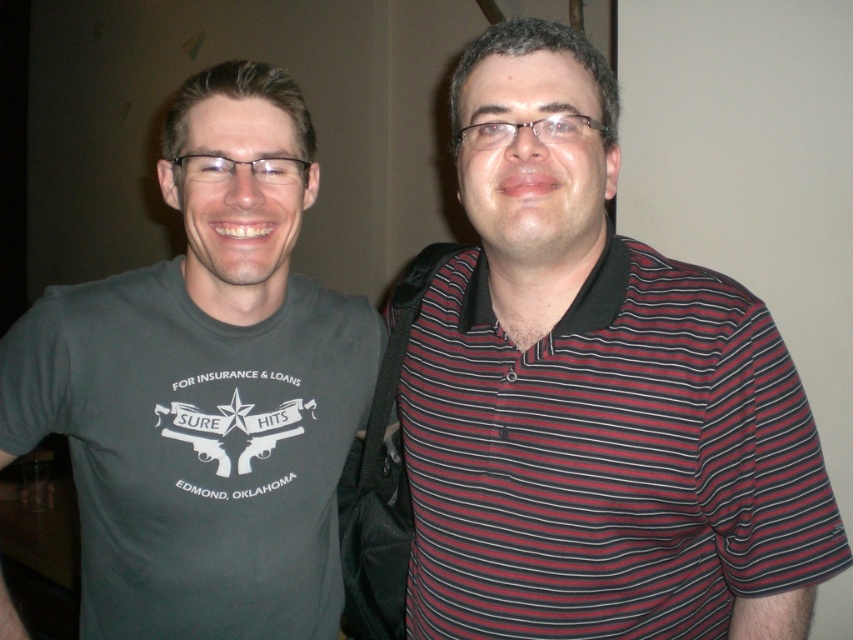
What are the coordinates of the striped cotton polo shirt at right?

The striped cotton polo shirt at right is located at coordinates point (595,396).